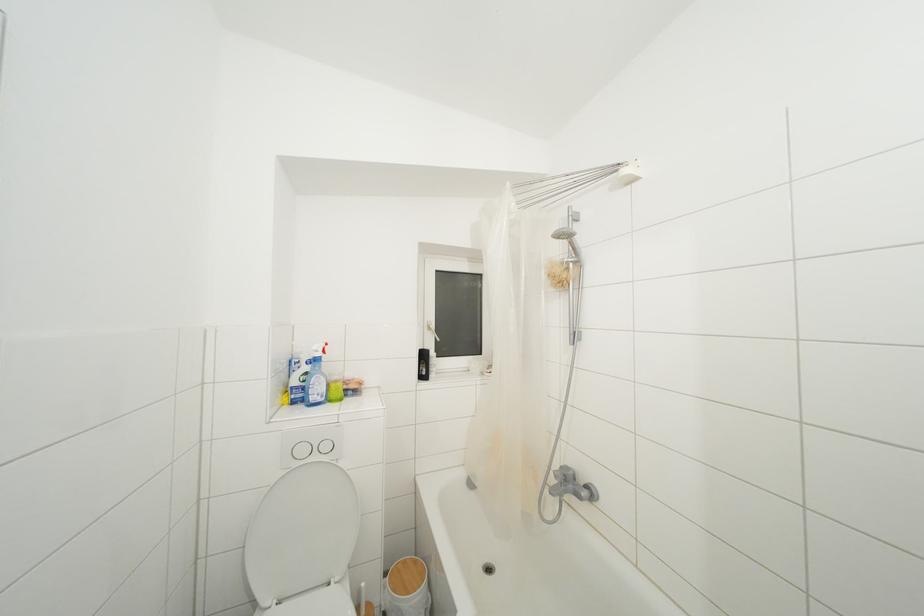
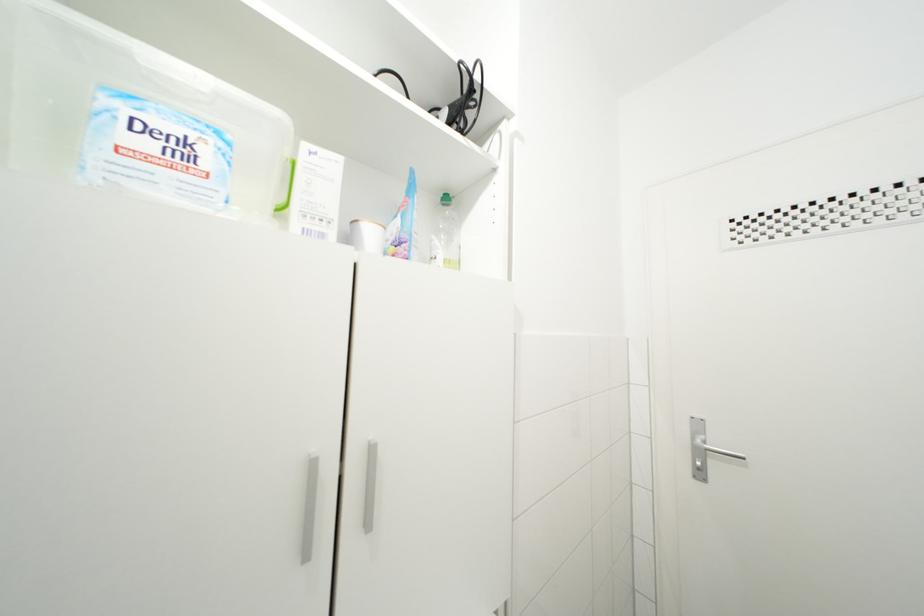
Question: The camera is either moving clockwise (left) or counter-clockwise (right) around the object. The first image is from the beginning of the video and the second image is from the end. Is the camera moving left or right when shooting the video?

Choices:
 (A) Left
 (B) Right

Answer: (A)